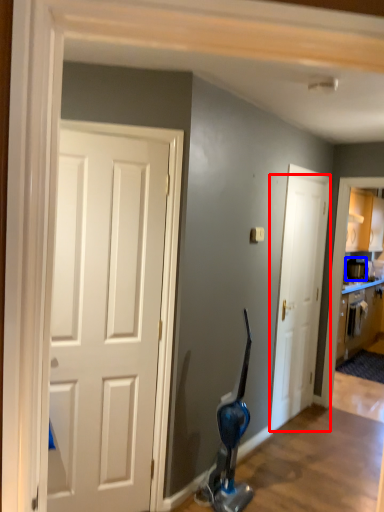
Question: Which object is further to the camera taking this photo, door (highlighted by a red box) or appliance (highlighted by a blue box)?

Choices:
 (A) door
 (B) appliance

Answer: (B)